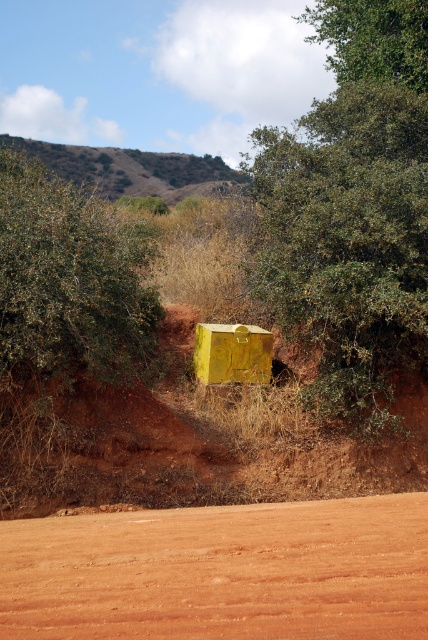
Does point (80, 568) come farther from viewer compared to point (422, 10)?

That is False.

Which is above, brown sandy dirt at lower center or green leafy tree at upper center?

green leafy tree at upper center

Does point (311, 563) come closer to viewer compared to point (421, 52)?

Yes, point (311, 563) is in front of point (421, 52).

Identify the location of brown sandy dirt at lower center. This screenshot has height=640, width=428. coord(220,572).

Which is below, brown sandy dirt at lower center or green leafy tree at center?

brown sandy dirt at lower center is lower down.

What do you see at coordinates (220, 572) in the screenshot?
I see `brown sandy dirt at lower center` at bounding box center [220, 572].

Between point (267, 584) and point (392, 321), which one is positioned in front?

Point (267, 584) is in front.

The image size is (428, 640). In order to click on brown sandy dirt at lower center in this screenshot , I will do `click(220, 572)`.

Does green leafy tree at center appear on the right side of green leafy bush at left?

Correct, you'll find green leafy tree at center to the right of green leafy bush at left.

Can you confirm if green leafy tree at center is positioned to the left of green leafy bush at left?

No, green leafy tree at center is not to the left of green leafy bush at left.

Is point (389, 96) positioned before point (14, 173)?

No, (389, 96) is behind (14, 173).

This screenshot has width=428, height=640. I want to click on green leafy tree at center, so click(x=347, y=241).